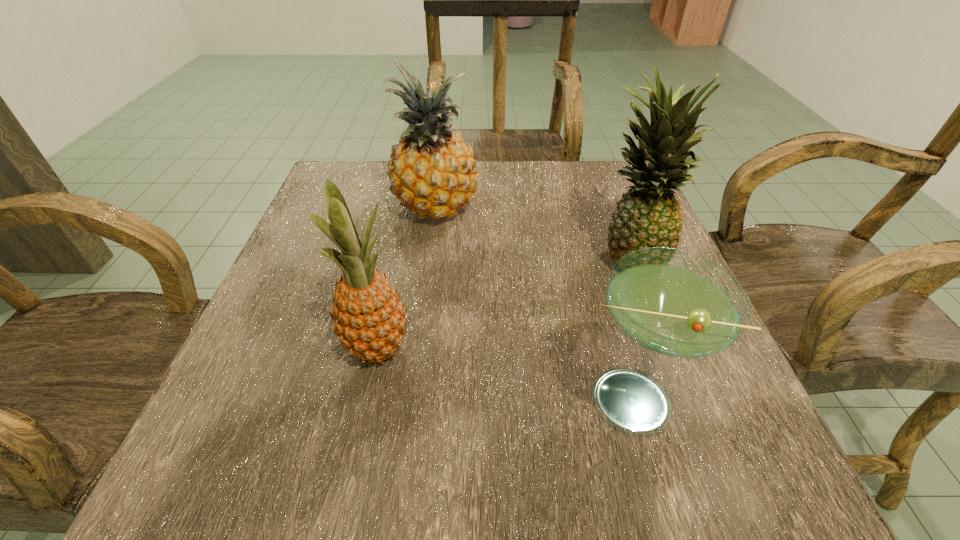
What are the coordinates of `the rightmost pineapple` in the screenshot? It's located at (648, 215).

You are a GUI agent. You are given a task and a screenshot of the screen. Output one action in this format:
    pyautogui.click(x=<x>, y=<y>)
    Task: Click on the nearest pineapple
    The image size is (960, 540).
    Given the screenshot: What is the action you would take?
    pyautogui.click(x=369, y=318)

Where is `martini`? The image size is (960, 540). martini is located at coordinates (673, 303).

Identify the location of vacant space located 0.280m on the back of the rightmost pineapple. This screenshot has height=540, width=960. (594, 164).

Find the location of a particular element. This screenshot has width=960, height=540. vacant area situated on the right of the nearest pineapple is located at coordinates (444, 349).

Identify the location of vacant space situated 0.120m on the back of the martini. (598, 302).

At what (x,y) coordinates should I click in order to perform the action: click on object positioned at the far edge. Please return your answer as a coordinate pair (x, y). This screenshot has height=540, width=960. Looking at the image, I should click on (432, 171).

The image size is (960, 540). Identify the location of object that is positioned at the near edge. (673, 303).

Find the location of a particular element. The height and width of the screenshot is (540, 960). object located in the left edge section of the desktop is located at coordinates (369, 318).

Locate an element on the screen. The width and height of the screenshot is (960, 540). pineapple positioned at the right edge is located at coordinates (648, 215).